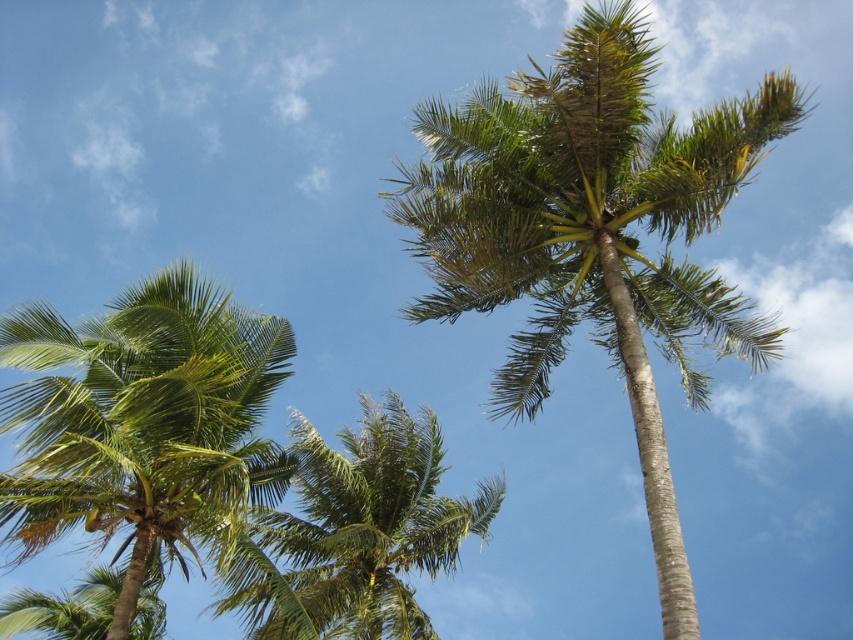
Is green leafy palm tree at upper center shorter than green leafy palm tree at left?

No, green leafy palm tree at upper center is not shorter than green leafy palm tree at left.

Who is more distant from viewer, (770, 355) or (274, 486)?

The point (770, 355) is more distant.

Between point (688, 364) and point (253, 438), which one is positioned in front?

Point (253, 438) is more forward.

Where is `green leafy palm tree at upper center`? green leafy palm tree at upper center is located at coordinates (593, 234).

Does point (631, 65) come farther from viewer compared to point (288, 625)?

Yes, point (631, 65) is behind point (288, 625).

Who is more distant from viewer, (618, 1) or (465, 520)?

Positioned behind is point (465, 520).

Image resolution: width=853 pixels, height=640 pixels. In order to click on green leafy palm tree at upper center in this screenshot , I will do `click(593, 234)`.

Who is taller, green leafy palm tree at left or green leafy coconut tree at center?

green leafy palm tree at left

Which is in front, point (88, 380) or point (373, 614)?

Positioned in front is point (88, 380).

What are the coordinates of `green leafy palm tree at left` in the screenshot? It's located at (143, 424).